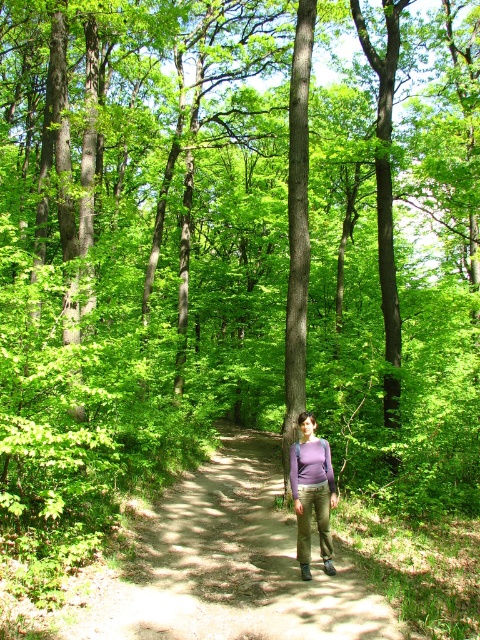
Question: Which point appears closest to the camera in this image?

Choices:
 (A) (322, 541)
 (B) (307, 452)
 (C) (210, 600)

Answer: (C)

Question: Does purple matte shirt at center lie behind purple matte sweatshirt at center?

Choices:
 (A) no
 (B) yes

Answer: (B)

Question: Which point is farther to the camera?

Choices:
 (A) purple matte shirt at center
 (B) dirt path at center
 (C) purple matte sweatshirt at center

Answer: (A)

Question: Is dirt path at center above purple matte shirt at center?

Choices:
 (A) yes
 (B) no

Answer: (B)

Question: In this image, where is purple matte shirt at center located relative to purple matte sweatshirt at center?

Choices:
 (A) below
 (B) above

Answer: (A)

Question: Among these objects, which one is nearest to the camera?

Choices:
 (A) purple matte sweatshirt at center
 (B) purple matte shirt at center
 (C) dirt path at center

Answer: (C)